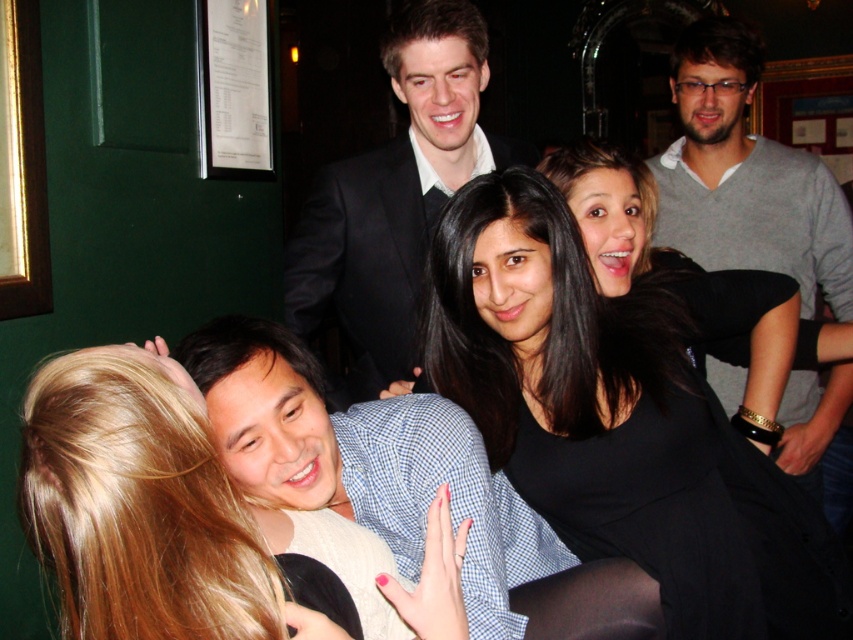
Question: Which of the following is the farthest from the observer?

Choices:
 (A) black matte dress at center
 (B) black suit at center
 (C) gray sweater at upper right

Answer: (C)

Question: Is black matte dress at center wider than gray sweater at upper right?

Choices:
 (A) yes
 (B) no

Answer: (A)

Question: Which of the following is the closest to the observer?

Choices:
 (A) (473, 125)
 (B) (529, 374)
 (C) (755, 40)

Answer: (B)

Question: Observing the image, what is the correct spatial positioning of black suit at center in reference to gray sweater at upper right?

Choices:
 (A) above
 (B) below

Answer: (A)

Question: Is black suit at center wider than gray sweater at upper right?

Choices:
 (A) yes
 (B) no

Answer: (A)

Question: Among these objects, which one is nearest to the camera?

Choices:
 (A) black suit at center
 (B) gray sweater at upper right

Answer: (A)